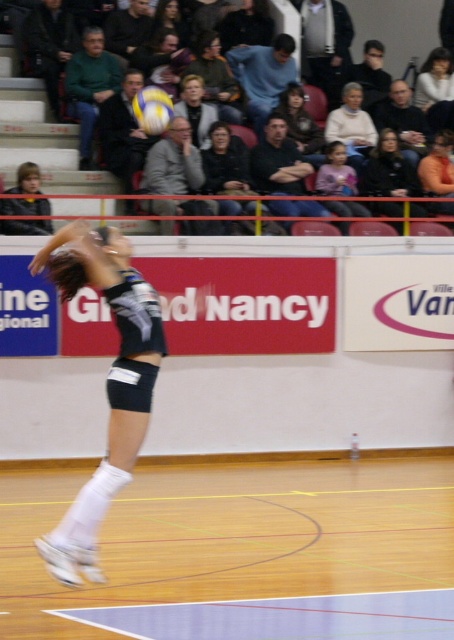
You are a photographer standing at the back of the arena. You want to capture a photo of the pink fabric shirt at center and dark brown hair at upper center. Which object should you focus on first if you want to ensure both are in focus?

The pink fabric shirt at center should be focused on first because it is closer to you than the dark brown hair at upper center, which is further away.

You are a photographer standing in the audience of the volleyball game. You want to capture a photo of the pink fabric shirt at center and the dark brown hair at upper center. Which object should you focus on first to ensure both are in the frame?

The pink fabric shirt at center is located below dark brown hair at upper center. To ensure both are in the frame, focus on the dark brown hair at upper center first, then adjust downward to include the pink fabric shirt at center.

You are a photographer at the volleyball game and want to capture a photo of both the white knit sweater at upper center and the orange fabric shirt at upper right in the background. Which object should be placed closer to the camera to ensure both are in focus?

The white knit sweater at upper center is taller than the orange fabric shirt at upper right, so to ensure both are in focus, the photographer should place the white knit sweater at upper center closer to the camera since it is taller and requires more depth of field.